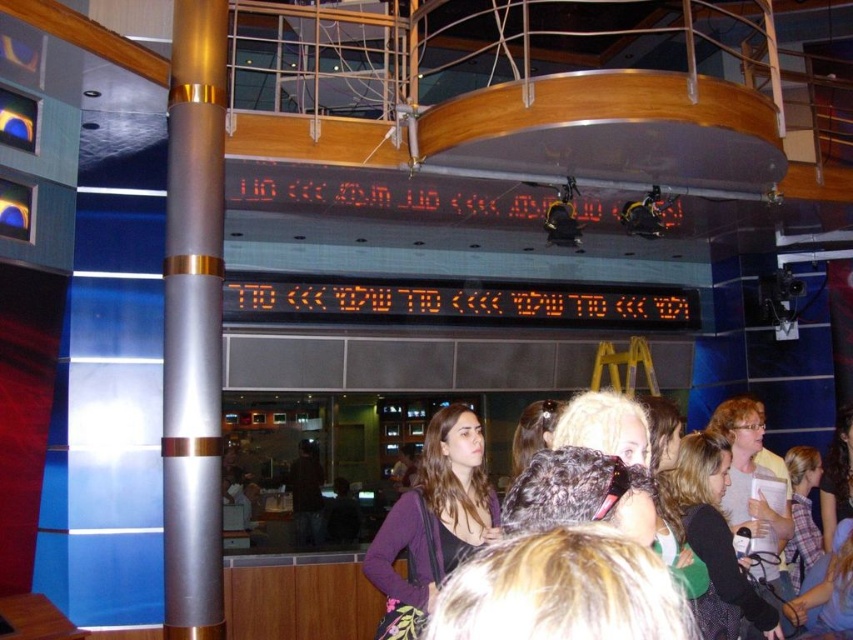
Question: Which of the following is the closest to the observer?

Choices:
 (A) (183, 346)
 (B) (735, 465)
 (C) (422, 468)

Answer: (C)

Question: Can you confirm if black led scoreboard at center is positioned to the left of purple matte/black fabric at center?

Choices:
 (A) no
 (B) yes

Answer: (A)

Question: Can you confirm if silver metallic pole at left is thinner than purple matte/black fabric at center?

Choices:
 (A) no
 (B) yes

Answer: (B)

Question: Which point is closer to the camera?

Choices:
 (A) (576, 294)
 (B) (741, 456)
 (C) (196, 483)
 (D) (396, 632)

Answer: (D)

Question: Does silver metallic pole at left appear over purple matte/black fabric at center?

Choices:
 (A) no
 (B) yes

Answer: (B)

Question: Based on their relative distances, which object is nearer to the silver metallic pole at left?

Choices:
 (A) black led scoreboard at center
 (B) black plastic scoreboard at upper center
 (C) blonde hair at center

Answer: (B)